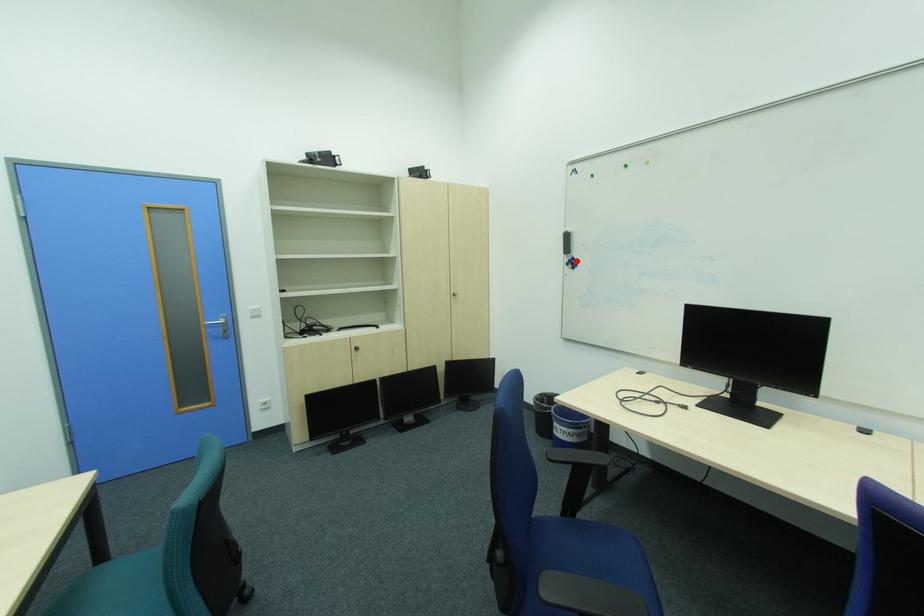
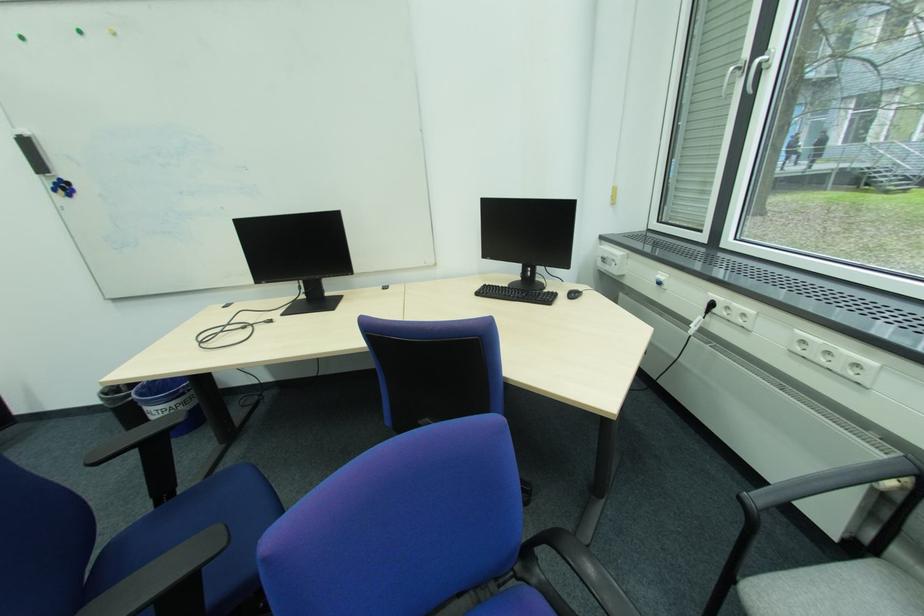
Question: I am providing you with two images of the same scene from different viewpoints. A red point is shown in image1. For the corresponding object point in image2, is it positioned nearer or farther from the camera?

Choices:
 (A) Nearer
 (B) Farther

Answer: (B)